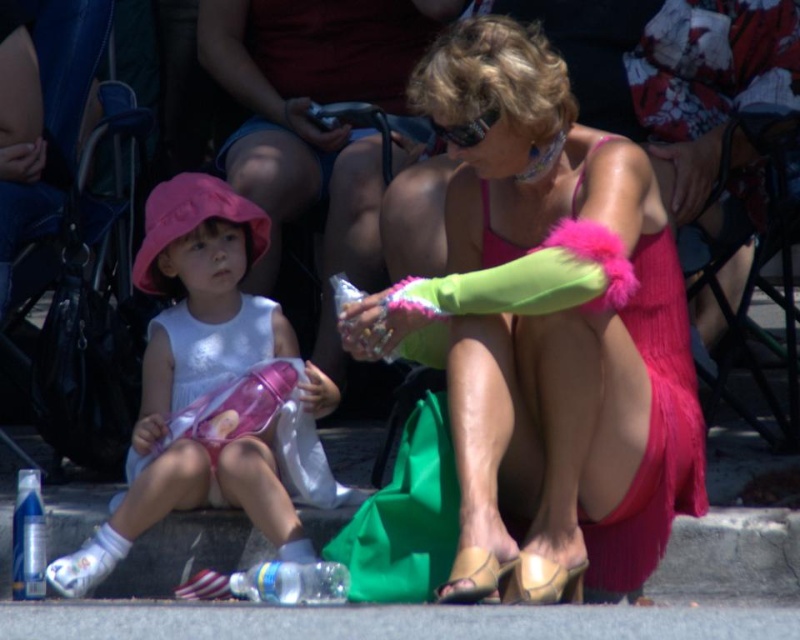
Question: Which of the following is the farthest from the observer?

Choices:
 (A) (578, 582)
 (B) (488, 600)
 (C) (458, 124)
 (D) (696, 387)

Answer: (D)

Question: Which object is positioned farthest from the pink fuzzy arm at center?

Choices:
 (A) pink fabric hat at left
 (B) sunglasses at center
 (C) transparent plastic bottle at lower center
 (D) blue plastic bottle at lower left

Answer: (D)

Question: Can you confirm if transparent plastic bottle at lower center is positioned above sunglasses at center?

Choices:
 (A) no
 (B) yes

Answer: (A)

Question: Which of the following is the farthest from the observer?

Choices:
 (A) matte gold sandal at lower center
 (B) pink fuzzy dress at center
 (C) sunglasses at center
 (D) blue plastic bottle at lower left

Answer: (D)

Question: Can you confirm if pink fabric hat at left is positioned to the left of transparent plastic bottle at lower center?

Choices:
 (A) no
 (B) yes

Answer: (B)

Question: Is the position of pink fabric hat at left more distant than that of sunglasses at center?

Choices:
 (A) no
 (B) yes

Answer: (B)